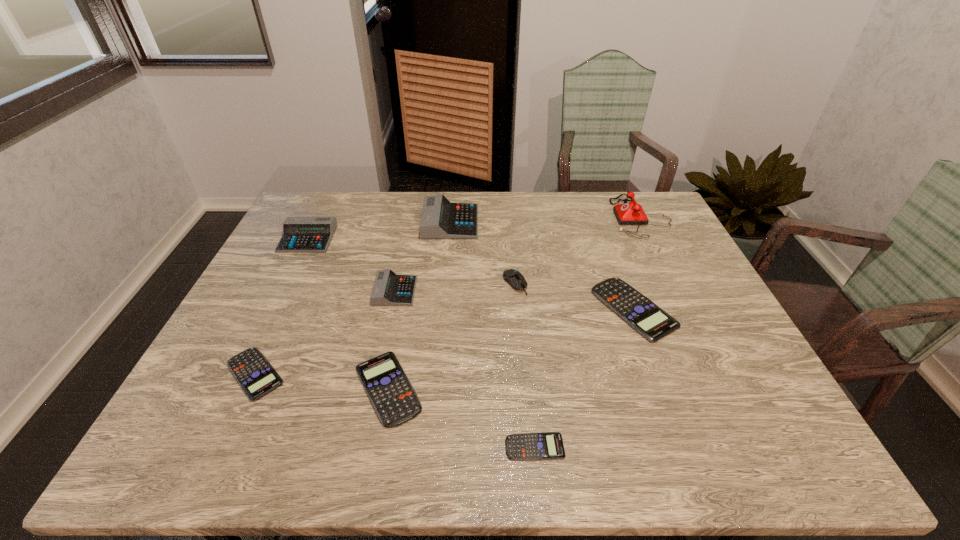
Where is `blue calculator object that ranks as the closest to the telephone`? This screenshot has height=540, width=960. blue calculator object that ranks as the closest to the telephone is located at coordinates (653, 323).

Locate which blue calculator is the closest to the sixth tallest calculator. Please provide its 2D coordinates. Your answer should be formatted as a tuple, i.e. [(x, y)], where the tuple contains the x and y coordinates of a point satisfying the conditions above.

[(394, 400)]

Find the location of `blank space that satisfies the following two spatial constraints: 1. on the dial of the telephone; 2. on the front side of the second biggest gray calculator`. blank space that satisfies the following two spatial constraints: 1. on the dial of the telephone; 2. on the front side of the second biggest gray calculator is located at coordinates (651, 239).

Where is `free point that satisfies the following two spatial constraints: 1. on the front side of the nearest blue calculator; 2. on the right side of the fifth tallest calculator`? This screenshot has height=540, width=960. free point that satisfies the following two spatial constraints: 1. on the front side of the nearest blue calculator; 2. on the right side of the fifth tallest calculator is located at coordinates (377, 447).

Locate an element on the screen. The height and width of the screenshot is (540, 960). vacant space that satisfies the following two spatial constraints: 1. on the dial of the tallest object; 2. on the front side of the second smallest blue calculator is located at coordinates (718, 374).

Locate an element on the screen. This screenshot has width=960, height=540. free spot that satisfies the following two spatial constraints: 1. on the front side of the nearest object; 2. on the right side of the second biggest gray calculator is located at coordinates (204, 447).